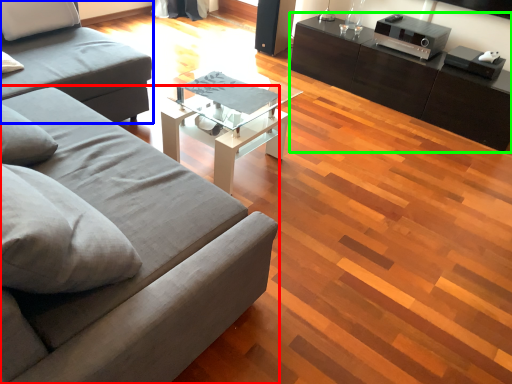
Question: Which is farther away from studio couch (highlighted by a red box)? studio couch (highlighted by a blue box) or table (highlighted by a green box)?

Choices:
 (A) studio couch
 (B) table

Answer: (B)